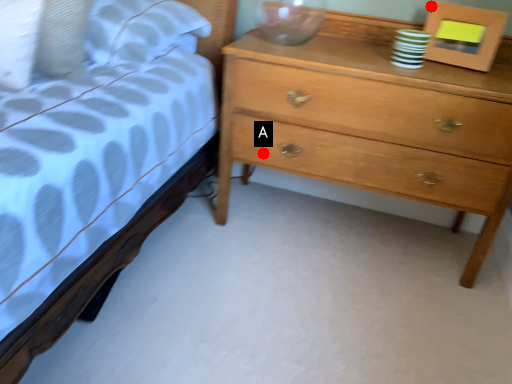
Question: Two points are circled on the image, labeled by A and B beside each circle. Which point is closer to the camera taking this photo?

Choices:
 (A) A is closer
 (B) B is closer

Answer: (B)